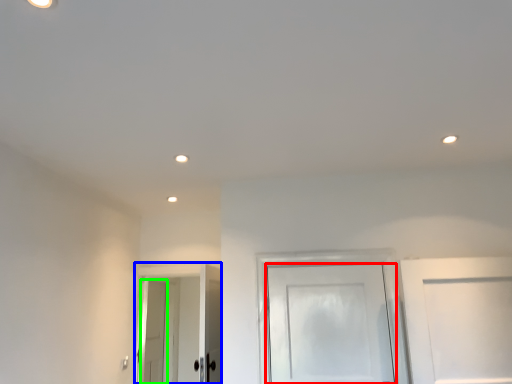
Question: Based on their relative distances, which object is farther from door (highlighted by a red box)? Choose from door (highlighted by a blue box) and door (highlighted by a green box).

Choices:
 (A) door
 (B) door

Answer: (B)